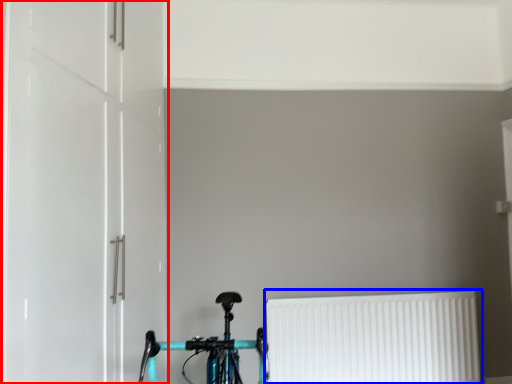
Question: Which point is closer to the camera, door (highlighted by a red box) or radiator (highlighted by a blue box)?

Choices:
 (A) door
 (B) radiator

Answer: (A)